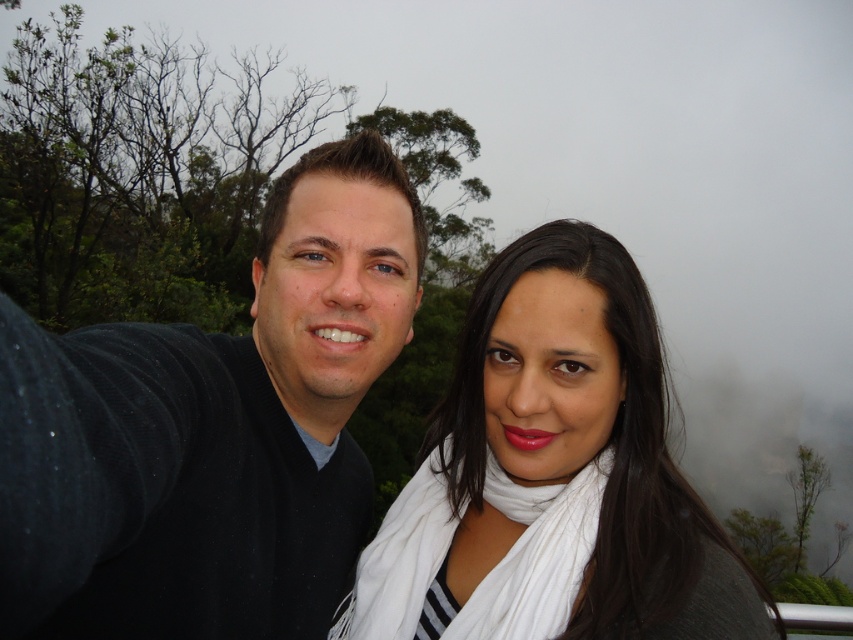
Is black sweater at center smaller than white soft scarf at center?

No, black sweater at center is not smaller than white soft scarf at center.

Is black sweater at center thinner than white soft scarf at center?

Correct, black sweater at center's width is less than white soft scarf at center's.

Is point (337, 413) positioned behind point (495, 605)?

Yes.

Find the location of a particular element. This screenshot has height=640, width=853. black sweater at center is located at coordinates (212, 432).

Is black sweater at center to the right of white scarf at right from the viewer's perspective?

In fact, black sweater at center is to the left of white scarf at right.

Does black sweater at center have a lesser width compared to white scarf at right?

Correct, black sweater at center's width is less than white scarf at right's.

Does point (221, 438) come closer to viewer compared to point (628, 396)?

Yes, point (221, 438) is in front of point (628, 396).

Where is `black sweater at center`? black sweater at center is located at coordinates (212, 432).

Is point (635, 424) positioned before point (430, 568)?

Yes, it is in front of point (430, 568).

Who is more distant from viewer, (639, 589) or (596, 474)?

Point (596, 474)

The height and width of the screenshot is (640, 853). In order to click on white scarf at right in this screenshot , I will do `click(553, 476)`.